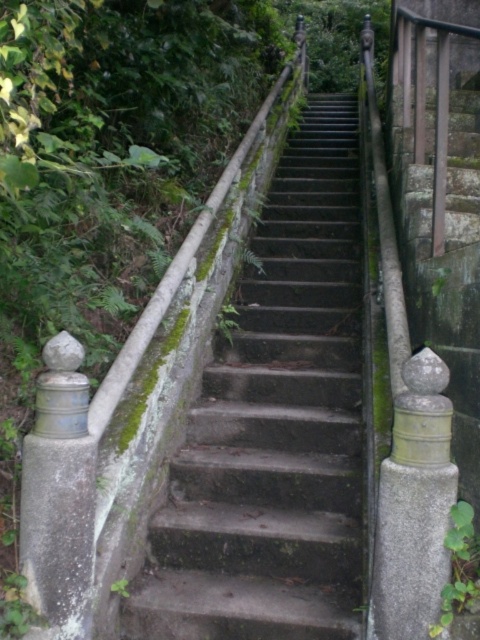
Is concrete stairs at center to the right of green mossy wall at upper left from the viewer's perspective?

Correct, you'll find concrete stairs at center to the right of green mossy wall at upper left.

Can you confirm if concrete stairs at center is shorter than green mossy wall at upper left?

Yes, concrete stairs at center is shorter than green mossy wall at upper left.

Is point (237, 573) positioned after point (70, 545)?

Yes.

At what (x,y) coordinates should I click in order to perform the action: click on concrete stairs at center. Please return your answer as a coordinate pair (x, y). The image size is (480, 640). Looking at the image, I should click on (275, 426).